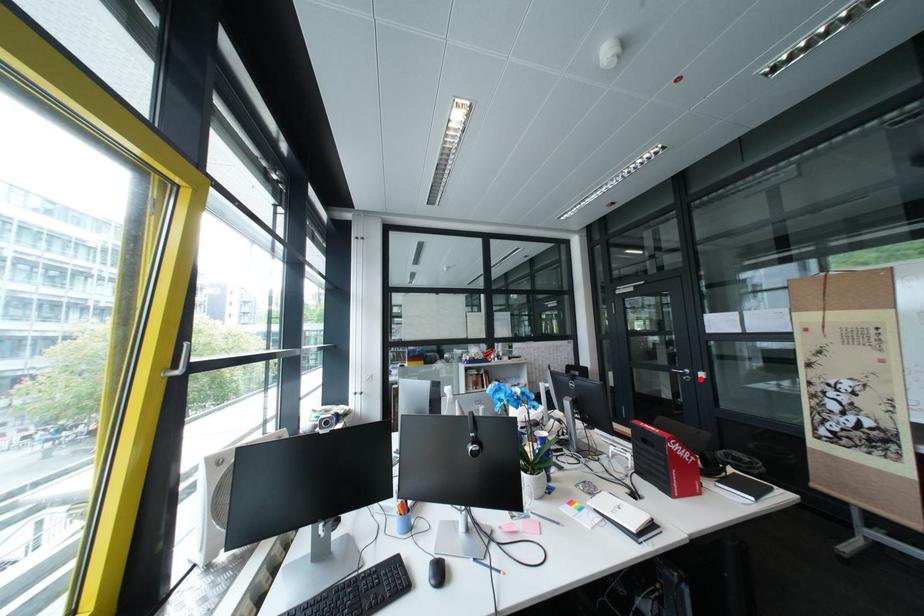
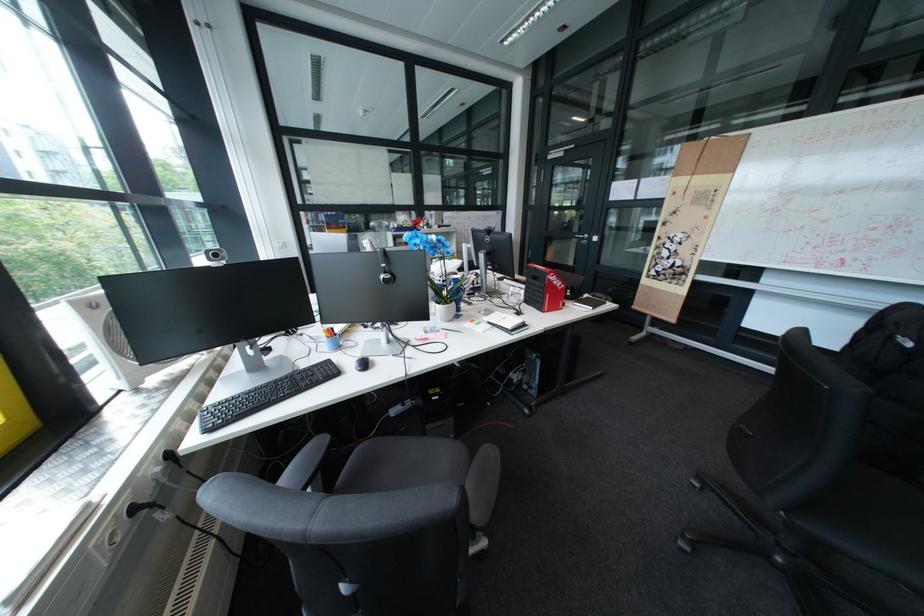
Locate, in the second image, the point that corresponds to the highlighted location in the first image.

(598, 243)